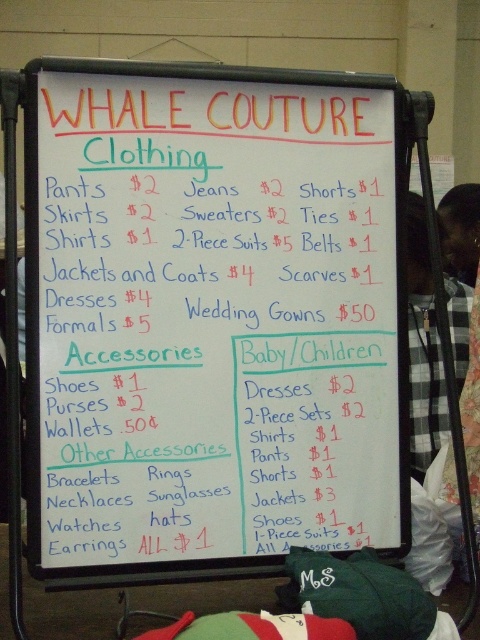
Which of these two, white paperboard at center or black checkered shirt at right, stands taller?

black checkered shirt at right

Is point (154, 508) positioned before point (463, 348)?

Yes, it is in front of point (463, 348).

The height and width of the screenshot is (640, 480). Find the location of `white paperboard at center`. white paperboard at center is located at coordinates (212, 317).